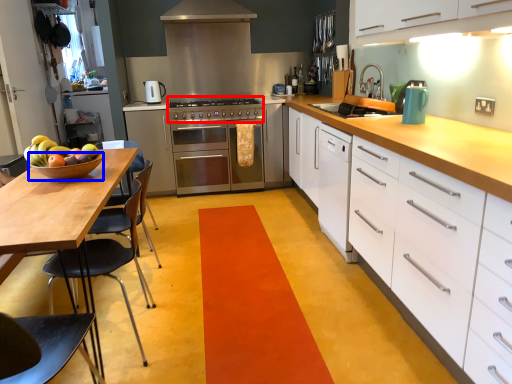
Question: Which point is further to the camera, gas stove (highlighted by a red box) or bowl (highlighted by a blue box)?

Choices:
 (A) gas stove
 (B) bowl

Answer: (A)